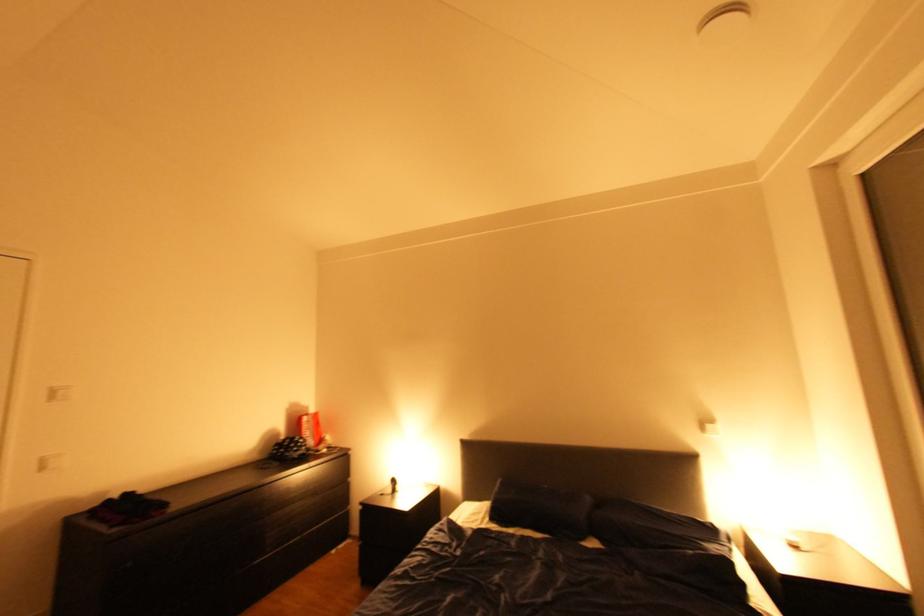
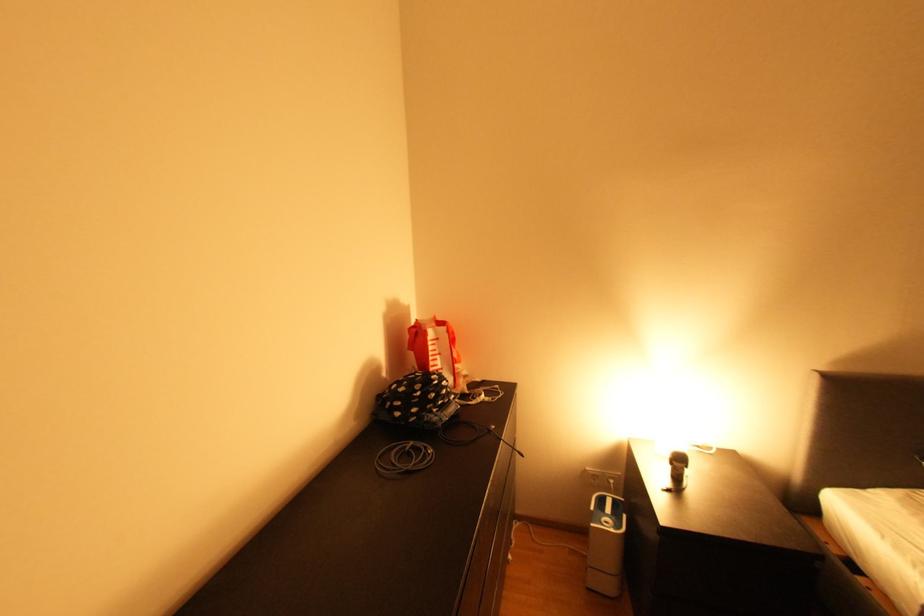
Locate, in the second image, the point that corresponds to (312,444) in the first image.

(457, 389)